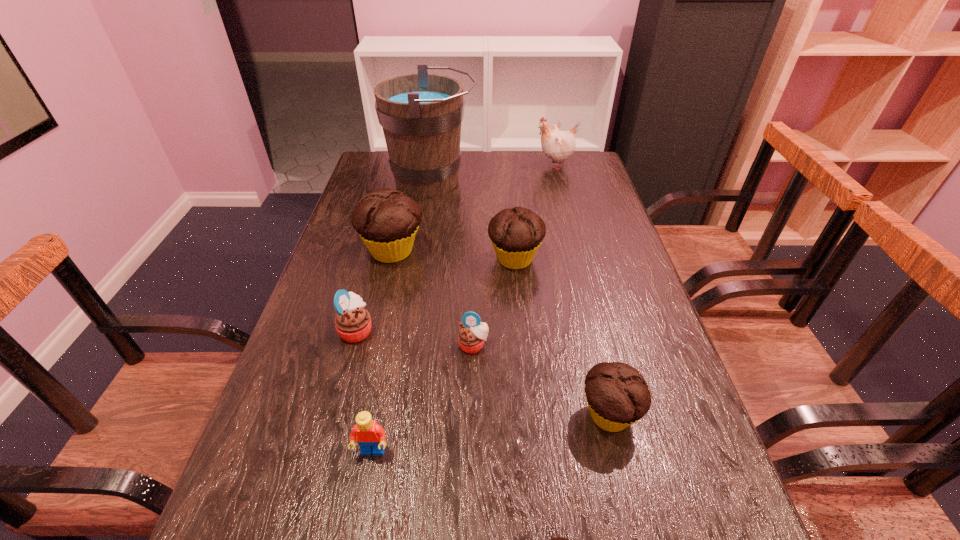
In the image, there is a desktop. What are the coordinates of `vacant region at the left edge` in the screenshot? It's located at (317, 327).

Locate an element on the screen. free location at the right edge of the desktop is located at coordinates (598, 206).

Find the location of a particular element. This screenshot has height=540, width=960. free point between the rightmost chocolate muffin and the leftmost chocolate muffin is located at coordinates (501, 333).

The image size is (960, 540). Find the location of `vacant point located between the fourth tallest object and the tallest object`. vacant point located between the fourth tallest object and the tallest object is located at coordinates (473, 220).

At what (x,y) coordinates should I click in order to perform the action: click on empty space between the bigger pink muffin and the tallest muffin. Please return your answer as a coordinate pair (x, y). The height and width of the screenshot is (540, 960). Looking at the image, I should click on (374, 291).

This screenshot has height=540, width=960. What are the coordinates of `free point between the rightmost chocolate muffin and the leftmost chocolate muffin` in the screenshot? It's located at (501, 333).

This screenshot has height=540, width=960. In order to click on vacant space that is in between the rightmost chocolate muffin and the left pink muffin in this screenshot , I will do `click(483, 372)`.

The image size is (960, 540). I want to click on free space between the Lego and the wine bucket, so click(402, 316).

Find the location of a particular element. vacant area between the tallest object and the fourth muffin from right to left is located at coordinates (453, 263).

Image resolution: width=960 pixels, height=540 pixels. Find the location of `free space between the Lego and the right pink muffin`. free space between the Lego and the right pink muffin is located at coordinates (423, 399).